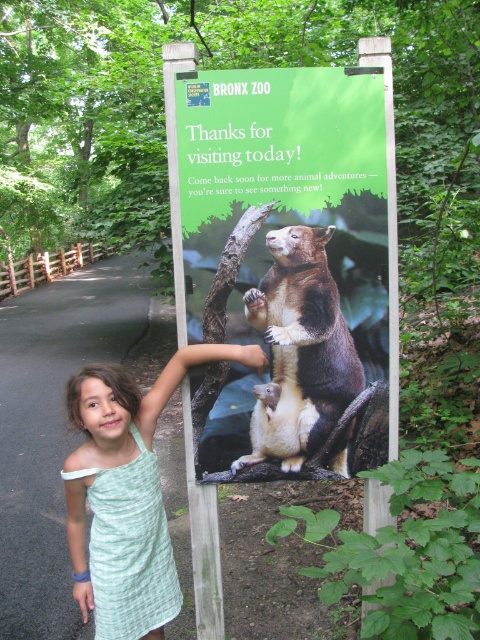
You are a zoo visitor who wants to take a photo of the brown furry bear at center and the green woven dress at center together in the frame. Can you position yourself so that both are visible in the same photo?

The brown furry bear at center is located above the green woven dress at center, so yes, you can position yourself below both objects to ensure both are visible in the same photo.

You are a photographer trying to capture both the green paper sign at center and the green woven dress at center in a single frame. Since both are green, you want to ensure they are distinguishable. Which object should you focus on to highlight its height advantage?

The green paper sign at center has a greater height compared to the green woven dress at center, so focusing on the green paper sign at center will highlight its height advantage.